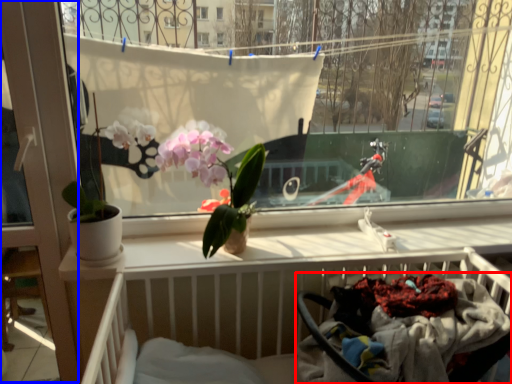
Question: Which of the following is the farthest to the observer, baby carriage (highlighted by a red box) or screen door (highlighted by a blue box)?

Choices:
 (A) baby carriage
 (B) screen door

Answer: (B)